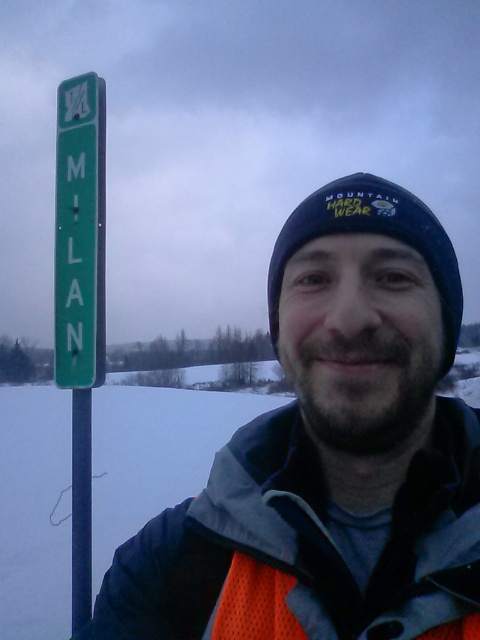
Looking at this image, you are a GPS device trying to guide a hiker to the nearest town. The hiker is currently standing at the point indicated by the coordinates point (331, 454). The town is located in the direction of the green road sign with white lettering that says MILAN. Is the hiker facing towards the direction of the town?

The point (331, 454) indicates matte black beanie at upper center. Since the green road sign with white lettering that says MILAN is to the left of the person, the hiker is facing away from the town. To reach the town, the hiker should turn around and head in the opposite direction.

You are a hiker trying to navigate through the snowy area. You notice the matte black beanie at upper center and the green road sign with white lettering that reads MILAN to your left. Which object is closer to your current position based on their coordinates?

The matte black beanie at upper center is located at point (331,454), while the green road sign with white lettering that reads MILAN is to the left. Since the beanie is at a higher coordinate value, it is closer to your current position compared to the road sign which is positioned further left.